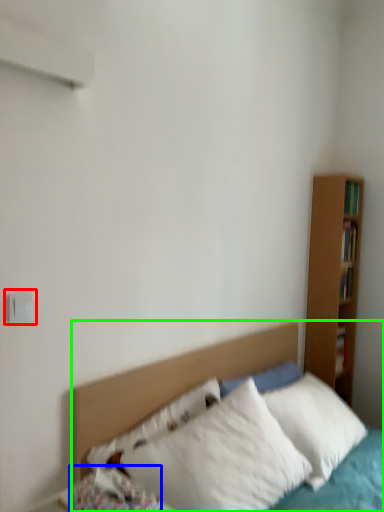
Question: Estimate the real-world distances between objects in this image. Which object is farther from electric outlet (highlighted by a red box), pillow (highlighted by a blue box) or bed (highlighted by a green box)?

Choices:
 (A) pillow
 (B) bed

Answer: (B)